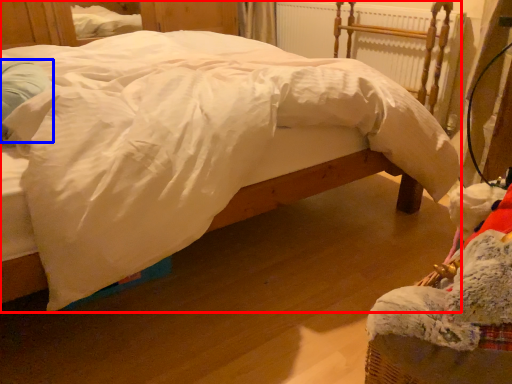
Question: Which of the following is the farthest to the observer, bed (highlighted by a red box) or pillow (highlighted by a blue box)?

Choices:
 (A) bed
 (B) pillow

Answer: (B)